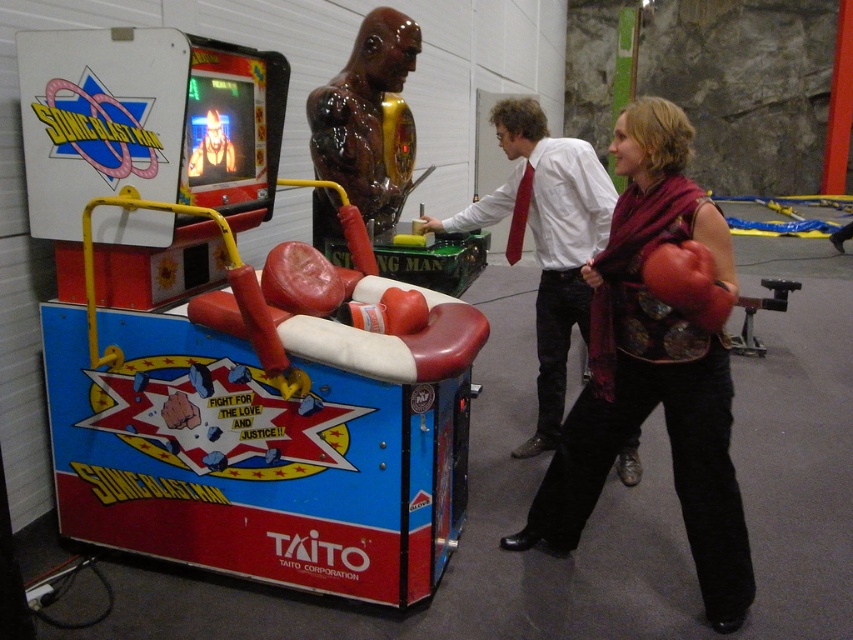
You are a game designer checking the layout of the Sonic Blast Man arcade machine. You notice the glossy metallic figure at center and the matte red boxing glove at center. Which object is positioned to the left?

The glossy metallic figure at center is positioned to the left of the matte red boxing glove at center according to the description.

You are a game designer working on a new arcade game and want to ensure that the leather boxing glove at center and the white glossy shirt at center are visible to players standing at the front of the machine. Given their sizes, which object might be more challenging to see from a distance?

The leather boxing glove at center occupies less space than the white glossy shirt at center, so the leather boxing glove at center might be more challenging to see from a distance due to its smaller size.

You are standing in the arcade and want to move from the point at coordinates point (560, 214) to the point at coordinates point (711, 269). Can you walk directly between them without any obstruction?

Since point (560, 214) is behind point (711, 269), you cannot walk directly between them without obstruction because the latter is blocking the path.